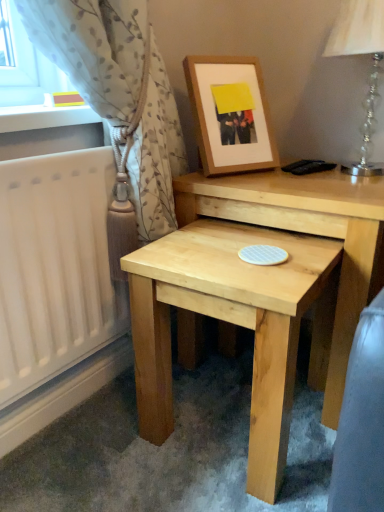
Where is `blank space situated above natural wood table at lower center, placed as the 2th table when sorted from back to front (from a real-world perspective)`? This screenshot has width=384, height=512. blank space situated above natural wood table at lower center, placed as the 2th table when sorted from back to front (from a real-world perspective) is located at coordinates (238, 250).